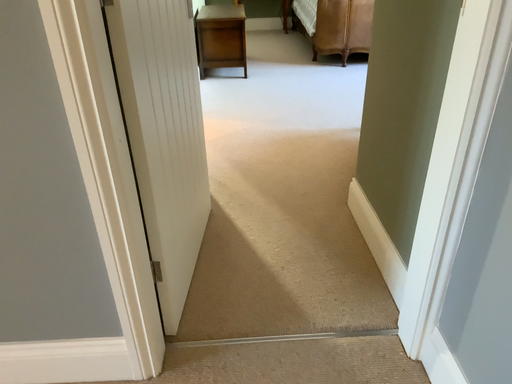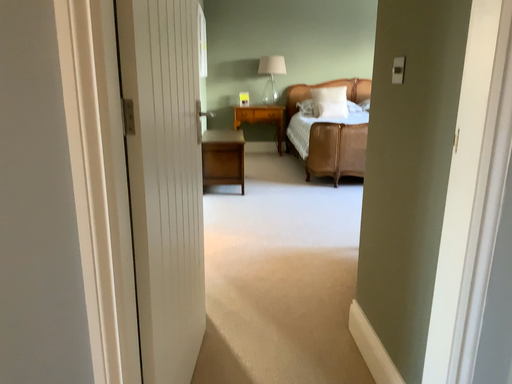
Question: Which way did the camera rotate in the video?

Choices:
 (A) rotated upward
 (B) rotated downward

Answer: (A)